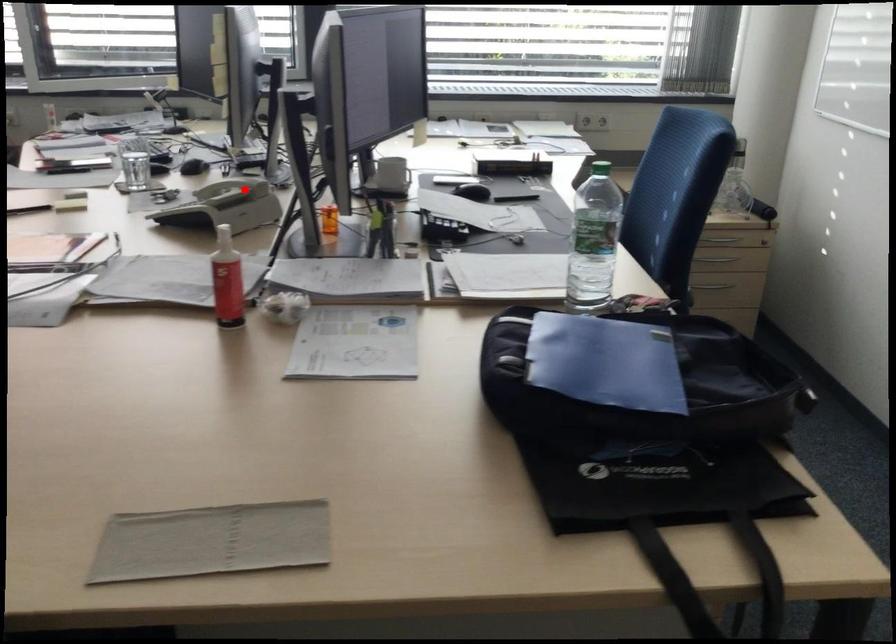
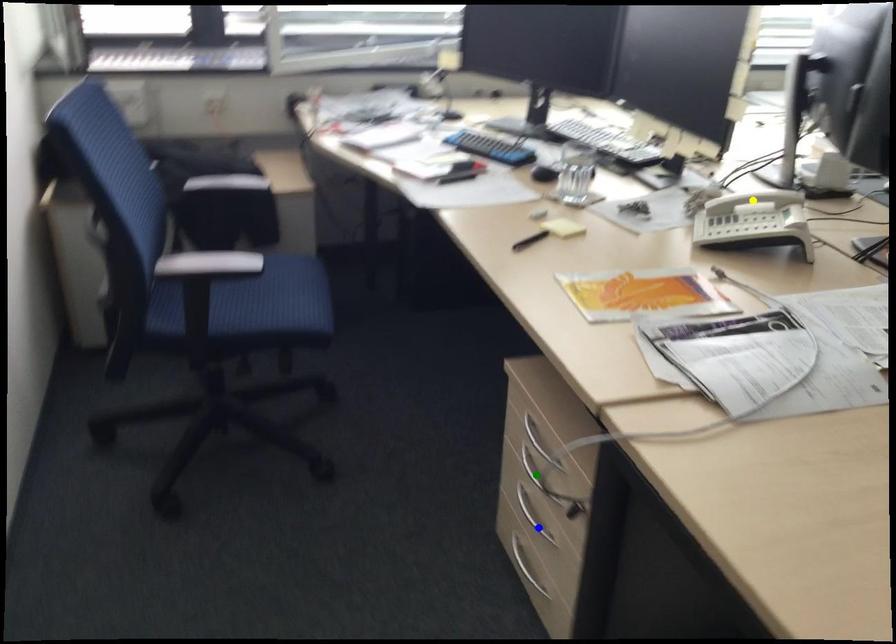
Question: I am providing you with two images of the same scene from different viewpoints. A red point is marked on the first image. You are given multiple points on the second image. Which mark in image 2 goes with the point in image 1?

Choices:
 (A) green point
 (B) yellow point
 (C) blue point

Answer: (B)